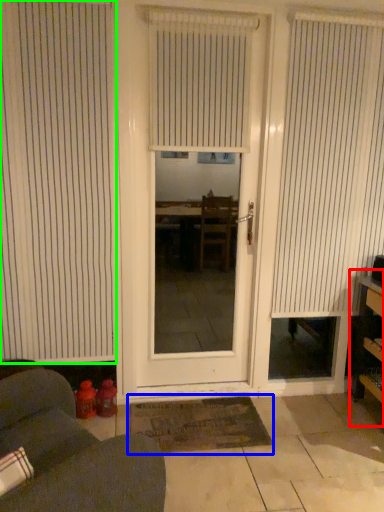
Question: Which object is positioned farthest from bookshelf (highlighted by a red box)? Select from doormat (highlighted by a blue box) and window blind (highlighted by a green box).

Choices:
 (A) doormat
 (B) window blind

Answer: (B)